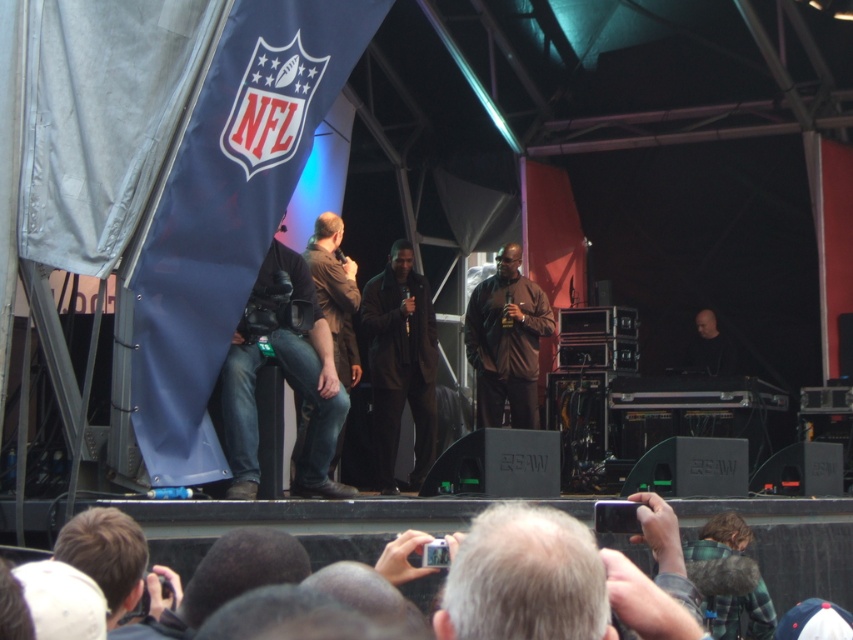
You are a photographer at the live event and want to ensure both the black leather jacket at center and the brown matte jacket at center are visible in your photo. Which jacket should you focus on first to ensure the taller one is captured properly?

The brown matte jacket at center is taller than the black leather jacket at center, so you should focus on capturing the brown matte jacket at center first to ensure its full height is visible in the photo.

You are a photographer at the event and want to capture a photo that includes both the brown matte jacket at center and the brown leather jacket at center. Based on their positions, which jacket should you focus on first to ensure both are in the frame?

The brown leather jacket at center should be focused on first since the brown matte jacket at center is to its right. By starting with the leftmost jacket, you can frame both in the shot.